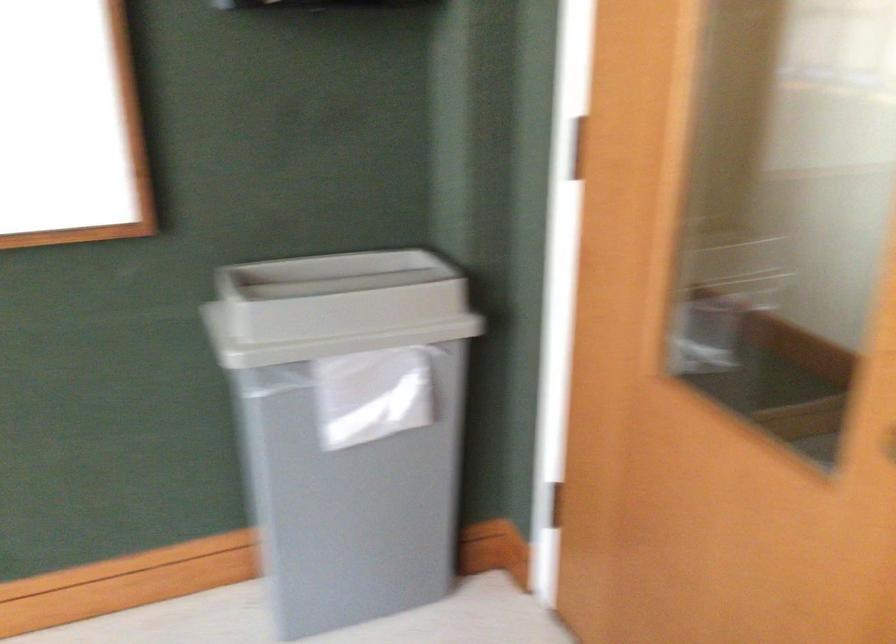
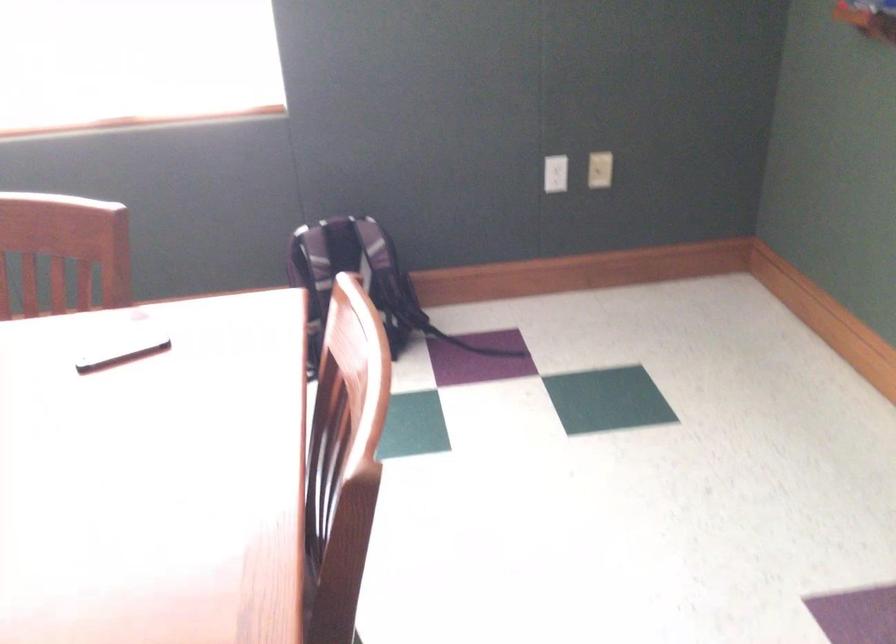
How did the camera likely rotate?

The camera rotated toward left-down.